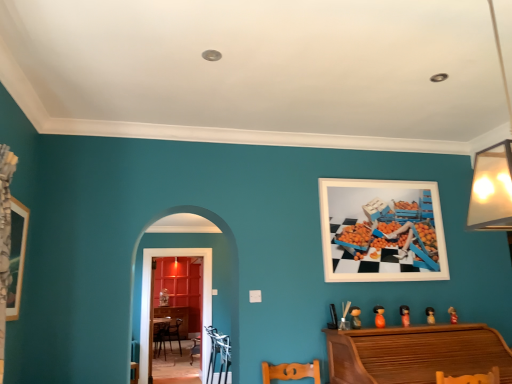
At what (x,y) coordinates should I click in order to perform the action: click on free spot in front of matte orange figurine at lower right, the 1th toy viewed from the right. Please return your answer as a coordinate pair (x, y). Looking at the image, I should click on (459, 327).